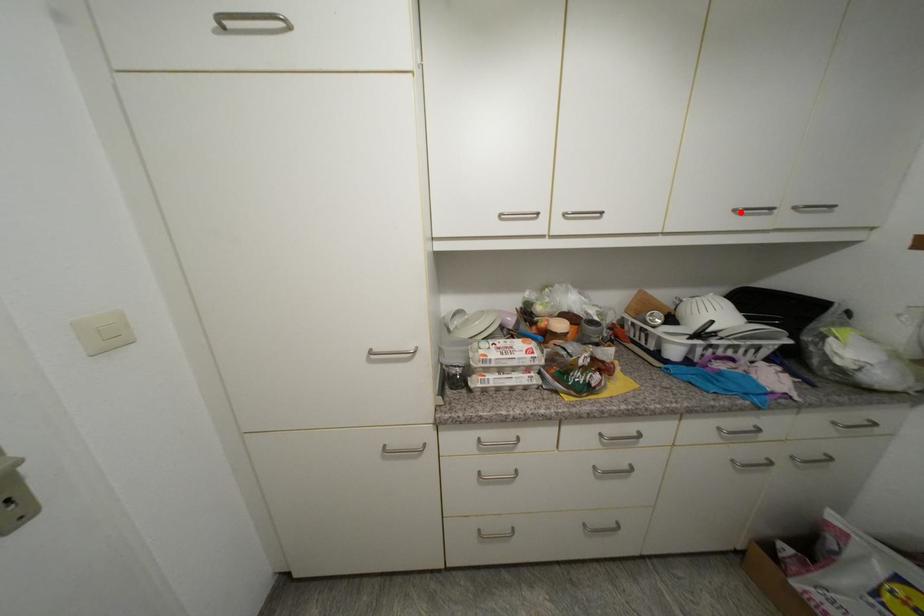
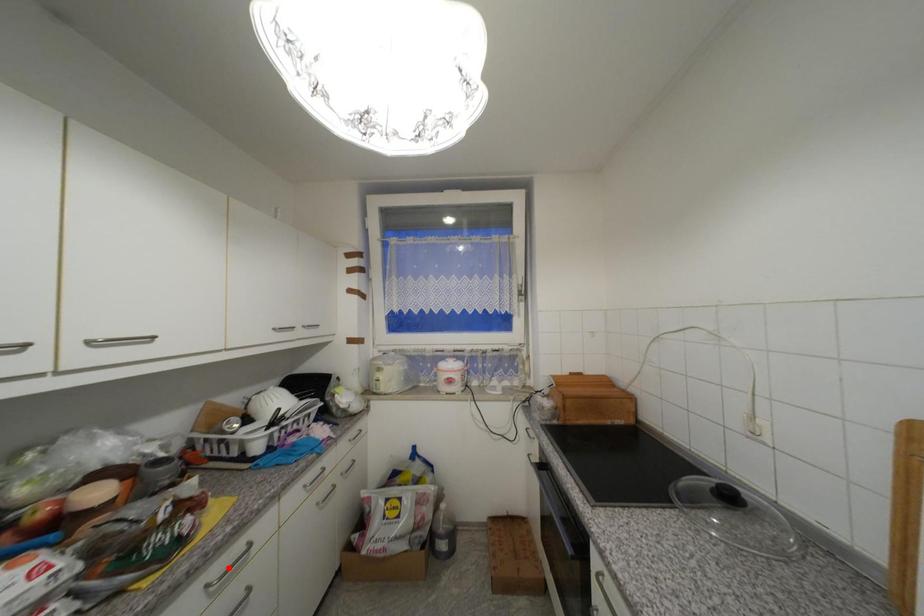
I am providing you with two images of the same scene from different viewpoints. A red point is marked on the first image and another point is marked on the second image. Are the points marked in image1 and image2 representing the same 3D position?

No